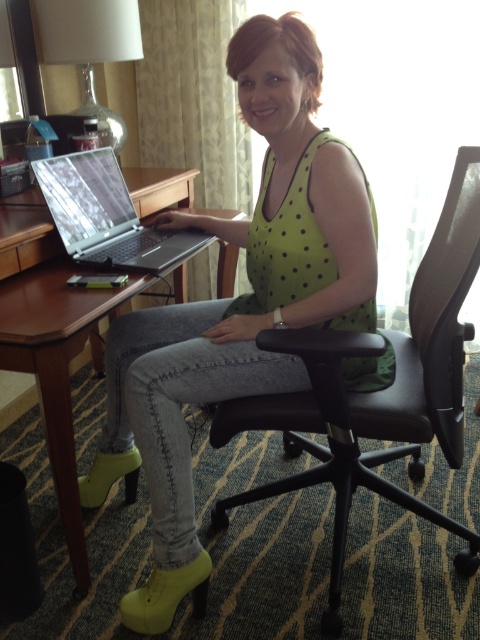
Between green polka dot tank top at center and brown wood table at left, which one appears on the left side from the viewer's perspective?

From the viewer's perspective, brown wood table at left appears more on the left side.

Consider the image. Does green polka dot tank top at center have a lesser height compared to brown wood table at left?

No, green polka dot tank top at center is not shorter than brown wood table at left.

Does point (357, 237) lie behind point (48, 394)?

Yes.

The width and height of the screenshot is (480, 640). I want to click on green polka dot tank top at center, so 238,305.

Which is above, black leather swivel chair at center or brown wood table at left?

Positioned higher is brown wood table at left.

In the scene shown: Can you confirm if black leather swivel chair at center is positioned to the right of brown wood table at left?

Yes, black leather swivel chair at center is to the right of brown wood table at left.

You are a GUI agent. You are given a task and a screenshot of the screen. Output one action in this format:
    pyautogui.click(x=<x>, y=<y>)
    Task: Click on the black leather swivel chair at center
    This screenshot has height=640, width=480.
    Given the screenshot: What is the action you would take?
    pyautogui.click(x=377, y=392)

The image size is (480, 640). Identify the location of black leather swivel chair at center. (377, 392).

Does point (157, 355) lie in front of point (453, 422)?

Yes, it is in front of point (453, 422).

Can you confirm if green polka dot tank top at center is wider than black leather swivel chair at center?

Yes, green polka dot tank top at center is wider than black leather swivel chair at center.

Which is in front, point (153, 346) or point (459, 184)?

Point (459, 184)

Where is `green polka dot tank top at center`? This screenshot has width=480, height=640. green polka dot tank top at center is located at coordinates (238, 305).